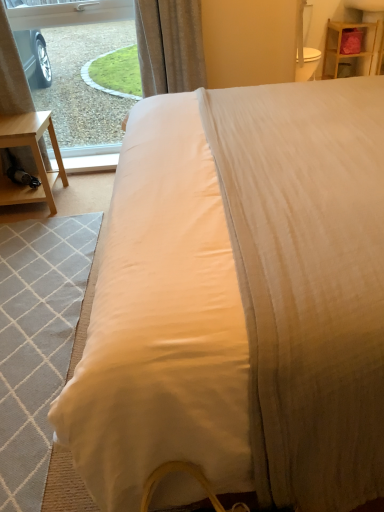
Where is `free point above light gray woven mat at lower left (from a real-world perspective)`? This screenshot has height=512, width=384. free point above light gray woven mat at lower left (from a real-world perspective) is located at coordinates (36, 296).